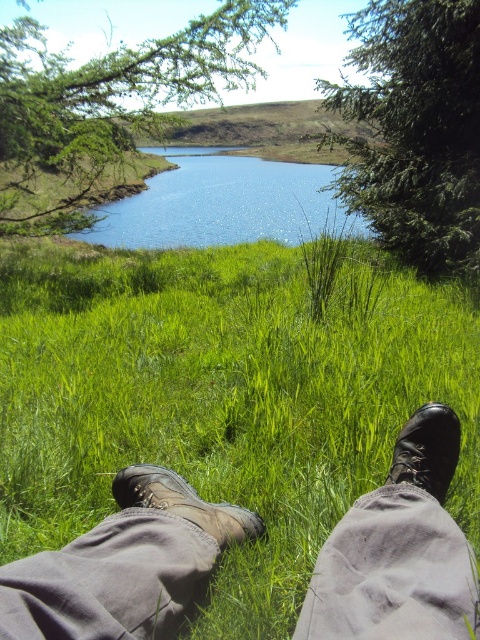
Question: Does blue glassy water at center appear under black leather boot at lower right?

Choices:
 (A) yes
 (B) no

Answer: (B)

Question: Which of the following is the farthest from the observer?

Choices:
 (A) (181, 481)
 (B) (144, 628)
 (C) (455, 445)

Answer: (C)

Question: Does leather boots at lower center lie behind blue glassy water at center?

Choices:
 (A) yes
 (B) no

Answer: (B)

Question: Which point appears farthest from the camera in this image?

Choices:
 (A) (207, 524)
 (B) (275, 195)
 (C) (22, 630)

Answer: (B)

Question: In this image, where is blue glassy water at center located relative to brown leather boot at lower center?

Choices:
 (A) left
 (B) right

Answer: (A)

Question: Among these objects, which one is farthest from the camera?

Choices:
 (A) brown leather boot at lower center
 (B) black leather boot at lower right
 (C) leather boots at lower center

Answer: (B)